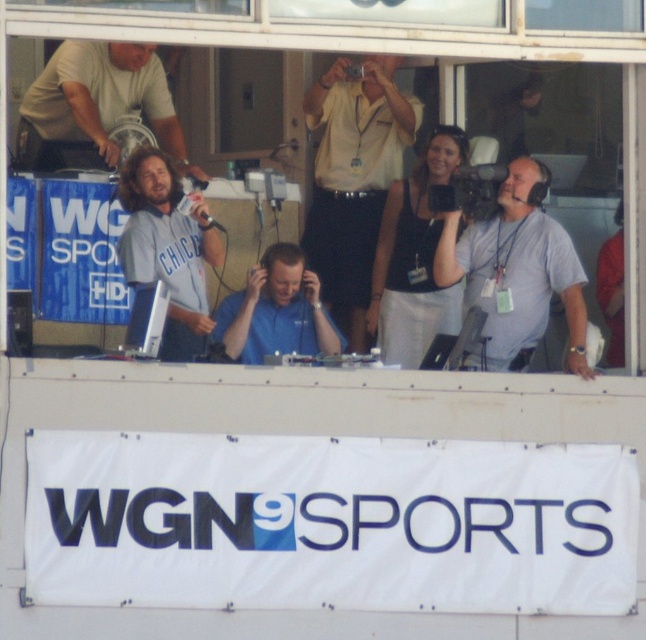
Question: Which object is the closest to the matte gray shirt at center?

Choices:
 (A) yellow shirt at center
 (B) black plastic video camera at upper center
 (C) transparent glass window at center
 (D) black plastic video camera at center

Answer: (D)

Question: Can you confirm if gray fabric camera at right is positioned above black plastic video camera at upper center?

Choices:
 (A) yes
 (B) no

Answer: (B)

Question: Which point is farther to the camera?

Choices:
 (A) black plastic video camera at center
 (B) matte gray shirt at center
 (C) gray fabric camera at right
 (D) light beige t-shirt at upper left

Answer: (D)

Question: Is gray fabric camera at right bigger than light beige t-shirt at upper left?

Choices:
 (A) no
 (B) yes

Answer: (B)

Question: Is matte gray shirt at center positioned in front of blue fabric shirt at center?

Choices:
 (A) no
 (B) yes

Answer: (A)

Question: Among these objects, which one is nearest to the camera?

Choices:
 (A) gray fabric camera at right
 (B) light beige t-shirt at upper left
 (C) matte gray shirt at center
 (D) yellow shirt at center

Answer: (A)